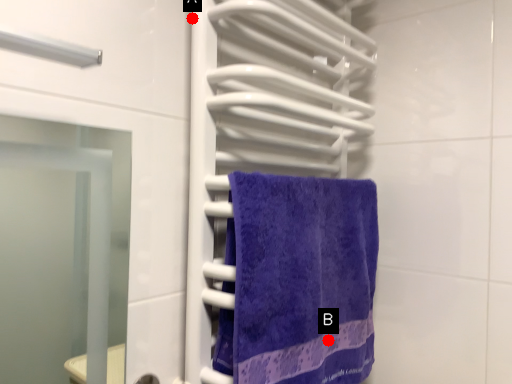
Question: Two points are circled on the image, labeled by A and B beside each circle. Which point is further to the camera?

Choices:
 (A) A is further
 (B) B is further

Answer: (B)